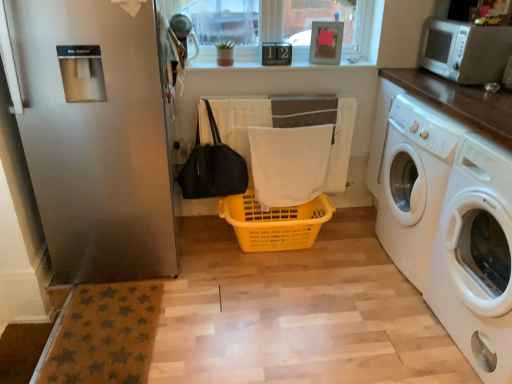
You are a GUI agent. You are given a task and a screenshot of the screen. Output one action in this format:
    pyautogui.click(x=<x>, y=<y>)
    Task: Click on the white glossy washing machine at right, the 1th washing machine positioned from the front
    
    Given the screenshot: What is the action you would take?
    pyautogui.click(x=476, y=258)

What do you see at coordinates (278, 28) in the screenshot? This screenshot has height=384, width=512. I see `clear glass window at upper center` at bounding box center [278, 28].

Locate an element on the screen. This screenshot has width=512, height=384. white fabric bath towel at center is located at coordinates (288, 163).

The width and height of the screenshot is (512, 384). What do you see at coordinates (288, 163) in the screenshot?
I see `white fabric bath towel at center` at bounding box center [288, 163].

Image resolution: width=512 pixels, height=384 pixels. What do you see at coordinates (414, 182) in the screenshot?
I see `white glossy washing machine at right, which is the second washing machine in front-to-back order` at bounding box center [414, 182].

Identify the location of yellow plastic basket at center. Image resolution: width=512 pixels, height=384 pixels. (274, 222).

This screenshot has height=384, width=512. I want to click on white glossy washing machine at right, the 1th washing machine positioned from the front, so click(x=476, y=258).

Can you confirm if black fabric bag at lower left is positioned to the right of yellow plastic basket at center?

Incorrect, black fabric bag at lower left is not on the right side of yellow plastic basket at center.

Is black fabric bag at lower left bigger than yellow plastic basket at center?

No, black fabric bag at lower left is not bigger than yellow plastic basket at center.

Can you see white fabric bath towel at center touching white plastic microwave at upper right?

white fabric bath towel at center and white plastic microwave at upper right are clearly separated.

How much distance is there between white fabric bath towel at center and white plastic microwave at upper right?

The distance of white fabric bath towel at center from white plastic microwave at upper right is 35.09 inches.

From a real-world perspective, is white fabric bath towel at center above or below white plastic microwave at upper right?

Clearly, from a real-world perspective, white fabric bath towel at center is below white plastic microwave at upper right.

Is point (291, 150) positioned after point (456, 61)?

Yes, it is behind point (456, 61).

Which object is further away from the camera, satin silver refrigerator at left or clear glass window at upper center?

Positioned behind is clear glass window at upper center.

Can you confirm if satin silver refrigerator at left is positioned to the left of clear glass window at upper center?

Indeed, satin silver refrigerator at left is positioned on the left side of clear glass window at upper center.

From a real-world perspective, is satin silver refrigerator at left positioned under clear glass window at upper center based on gravity?

Indeed, from a real-world perspective, satin silver refrigerator at left is positioned beneath clear glass window at upper center.

Based on the photo, from the image's perspective, relative to clear glass window at upper center, is satin silver refrigerator at left above or below?

satin silver refrigerator at left is situated lower than clear glass window at upper center in the image.

Is white plastic microwave at upper right bigger than white glossy washing machine at right, arranged as the second washing machine when viewed from the back?

No, white plastic microwave at upper right is not bigger than white glossy washing machine at right, arranged as the second washing machine when viewed from the back.

Is white plastic microwave at upper right in contact with white glossy washing machine at right, arranged as the second washing machine when viewed from the back?

They are not placed beside each other.

Who is taller, white plastic microwave at upper right or white glossy washing machine at right, the 1th washing machine positioned from the front?

white glossy washing machine at right, the 1th washing machine positioned from the front, is taller.

Which object is further away from the camera, white plastic microwave at upper right or white glossy washing machine at right, arranged as the second washing machine when viewed from the back?

white plastic microwave at upper right is behind.

Which is more to the right, white fabric bath towel at center or black fabric bag at lower left?

From the viewer's perspective, white fabric bath towel at center appears more on the right side.

Is white fabric bath towel at center beside black fabric bag at lower left?

No, white fabric bath towel at center is not making contact with black fabric bag at lower left.

Does point (277, 161) come farther from viewer compared to point (212, 194)?

No.

Who is taller, white fabric bath towel at center or black fabric bag at lower left?

Standing taller between the two is white fabric bath towel at center.

From a real-world perspective, who is located higher, clear glass window at upper center or white glossy washing machine at right, the 1th washing machine positioned from the front?

clear glass window at upper center.

The image size is (512, 384). Find the location of `the 2nd washing machine positioned below the clear glass window at upper center (from the image's perspective)`. the 2nd washing machine positioned below the clear glass window at upper center (from the image's perspective) is located at coordinates (476, 258).

Is clear glass window at upper center not near white glossy washing machine at right, arranged as the second washing machine when viewed from the back?

clear glass window at upper center is far away from white glossy washing machine at right, arranged as the second washing machine when viewed from the back.

Considering the sizes of objects white glossy washing machine at right, which ranks as the first washing machine in back-to-front order, and white glossy washing machine at right, arranged as the second washing machine when viewed from the back, in the image provided, who is bigger, white glossy washing machine at right, which ranks as the first washing machine in back-to-front order, or white glossy washing machine at right, arranged as the second washing machine when viewed from the back,?

white glossy washing machine at right, which ranks as the first washing machine in back-to-front order.

Is white glossy washing machine at right, which is the second washing machine in front-to-back order, facing away from white glossy washing machine at right, the 1th washing machine positioned from the front?

No, white glossy washing machine at right, which is the second washing machine in front-to-back order, is not facing the opposite direction of white glossy washing machine at right, the 1th washing machine positioned from the front.

Where is `bag in front of the yellow plastic basket at center`? bag in front of the yellow plastic basket at center is located at coordinates (213, 168).

You are a GUI agent. You are given a task and a screenshot of the screen. Output one action in this format:
    pyautogui.click(x=<x>, y=<y>)
    Task: Click on the microwave oven above the white fabric bath towel at center (from a real-world perspective)
    The image size is (512, 384).
    Given the screenshot: What is the action you would take?
    pyautogui.click(x=465, y=51)

From the image, which object appears to be farther from clear glass window at upper center, satin silver refrigerator at left or black fabric bag at lower left?

Based on the image, satin silver refrigerator at left appears to be further to clear glass window at upper center.

Based on the photo, from the image, which object appears to be nearer to white glossy washing machine at right, which ranks as the first washing machine in back-to-front order, satin silver refrigerator at left or white glossy washing machine at right, the 1th washing machine positioned from the front?

white glossy washing machine at right, the 1th washing machine positioned from the front, lies closer to white glossy washing machine at right, which ranks as the first washing machine in back-to-front order, than the other object.

Estimate the real-world distances between objects in this image. Which object is closer to clear glass window at upper center, satin silver refrigerator at left or white plastic microwave at upper right?

white plastic microwave at upper right lies closer to clear glass window at upper center than the other object.

Based on the photo, based on their spatial positions, is black fabric bag at lower left or yellow plastic basket at center closer to clear glass window at upper center?

black fabric bag at lower left.

Based on their spatial positions, is yellow plastic basket at center or satin silver refrigerator at left closer to white glossy washing machine at right, arranged as the second washing machine when viewed from the back?

The object closer to white glossy washing machine at right, arranged as the second washing machine when viewed from the back, is yellow plastic basket at center.

From the image, which object appears to be nearer to clear glass window at upper center, yellow plastic basket at center or white glossy washing machine at right, arranged as the second washing machine when viewed from the back?

yellow plastic basket at center lies closer to clear glass window at upper center than the other object.

Estimate the real-world distances between objects in this image. Which object is closer to white glossy washing machine at right, arranged as the second washing machine when viewed from the back, clear glass window at upper center or white fabric bath towel at center?

white fabric bath towel at center.

When comparing their distances from white glossy washing machine at right, which is the second washing machine in front-to-back order, does white plastic microwave at upper right or clear glass window at upper center seem further?

The object further to white glossy washing machine at right, which is the second washing machine in front-to-back order, is clear glass window at upper center.

Image resolution: width=512 pixels, height=384 pixels. Identify the location of bath towel located between white glossy washing machine at right, arranged as the second washing machine when viewed from the back, and clear glass window at upper center in the depth direction. (288, 163).

You are a GUI agent. You are given a task and a screenshot of the screen. Output one action in this format:
    pyautogui.click(x=<x>, y=<y>)
    Task: Click on the bath towel between clear glass window at upper center and white glossy washing machine at right, which is the second washing machine in front-to-back order, from left to right
    This screenshot has height=384, width=512.
    Given the screenshot: What is the action you would take?
    pyautogui.click(x=288, y=163)

The image size is (512, 384). In order to click on bag between clear glass window at upper center and yellow plastic basket at center vertically in this screenshot , I will do 213,168.

Locate an element on the screen. The width and height of the screenshot is (512, 384). basket between satin silver refrigerator at left and white glossy washing machine at right, which is the second washing machine in front-to-back order, from left to right is located at coordinates (274, 222).